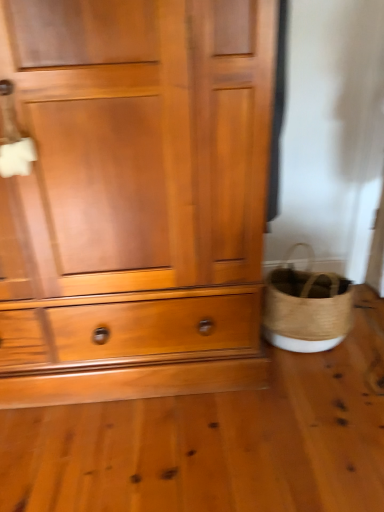
Question: Can you confirm if woven straw basket at lower right is wider than matte wood chest of drawers at center?

Choices:
 (A) no
 (B) yes

Answer: (A)

Question: Is woven straw basket at lower right outside of matte wood chest of drawers at center?

Choices:
 (A) no
 (B) yes

Answer: (B)

Question: Considering the relative sizes of woven straw basket at lower right and matte wood chest of drawers at center in the image provided, is woven straw basket at lower right smaller than matte wood chest of drawers at center?

Choices:
 (A) yes
 (B) no

Answer: (A)

Question: Does woven straw basket at lower right lie in front of matte wood chest of drawers at center?

Choices:
 (A) no
 (B) yes

Answer: (A)

Question: Is matte wood chest of drawers at center completely or partially inside woven straw basket at lower right?

Choices:
 (A) no
 (B) yes

Answer: (A)

Question: From a real-world perspective, is woven straw basket at lower right under matte wood chest of drawers at center?

Choices:
 (A) yes
 (B) no

Answer: (A)

Question: From the image's perspective, is matte wood chest of drawers at center above woven straw basket at lower right?

Choices:
 (A) no
 (B) yes

Answer: (B)

Question: From a real-world perspective, is matte wood chest of drawers at center positioned over woven straw basket at lower right based on gravity?

Choices:
 (A) yes
 (B) no

Answer: (A)

Question: From the image's perspective, is matte wood chest of drawers at center beneath woven straw basket at lower right?

Choices:
 (A) yes
 (B) no

Answer: (B)

Question: Are matte wood chest of drawers at center and woven straw basket at lower right making contact?

Choices:
 (A) yes
 (B) no

Answer: (B)

Question: Considering the relative positions of matte wood chest of drawers at center and woven straw basket at lower right in the image provided, is matte wood chest of drawers at center to the right of woven straw basket at lower right from the viewer's perspective?

Choices:
 (A) yes
 (B) no

Answer: (B)

Question: Is matte wood chest of drawers at center not inside woven straw basket at lower right?

Choices:
 (A) no
 (B) yes

Answer: (B)

Question: Considering their positions, is woven straw basket at lower right located in front of or behind matte wood chest of drawers at center?

Choices:
 (A) front
 (B) behind

Answer: (B)